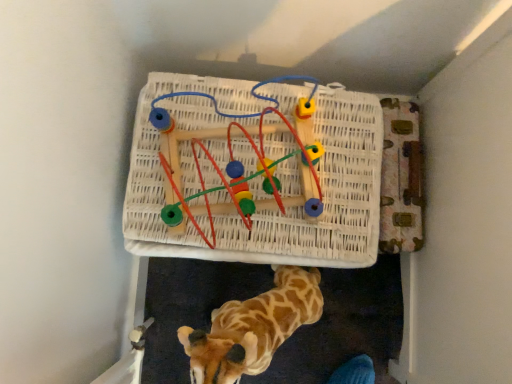
Question: From a real-world perspective, is spotted plush giraffe at lower center positioned above or below woven wood maze at upper center?

Choices:
 (A) above
 (B) below

Answer: (B)

Question: Relative to woven wood maze at upper center, is spotted plush giraffe at lower center in front or behind?

Choices:
 (A) behind
 (B) front

Answer: (B)

Question: Is spotted plush giraffe at lower center inside the boundaries of woven wood maze at upper center, or outside?

Choices:
 (A) inside
 (B) outside

Answer: (B)

Question: Visually, is woven wood maze at upper center positioned to the left or to the right of spotted plush giraffe at lower center?

Choices:
 (A) right
 (B) left

Answer: (B)

Question: From a real-world perspective, is woven wood maze at upper center positioned above or below spotted plush giraffe at lower center?

Choices:
 (A) above
 (B) below

Answer: (A)

Question: From the image's perspective, relative to spotted plush giraffe at lower center, is woven wood maze at upper center above or below?

Choices:
 (A) above
 (B) below

Answer: (A)

Question: Would you say woven wood maze at upper center is inside or outside spotted plush giraffe at lower center?

Choices:
 (A) outside
 (B) inside

Answer: (A)